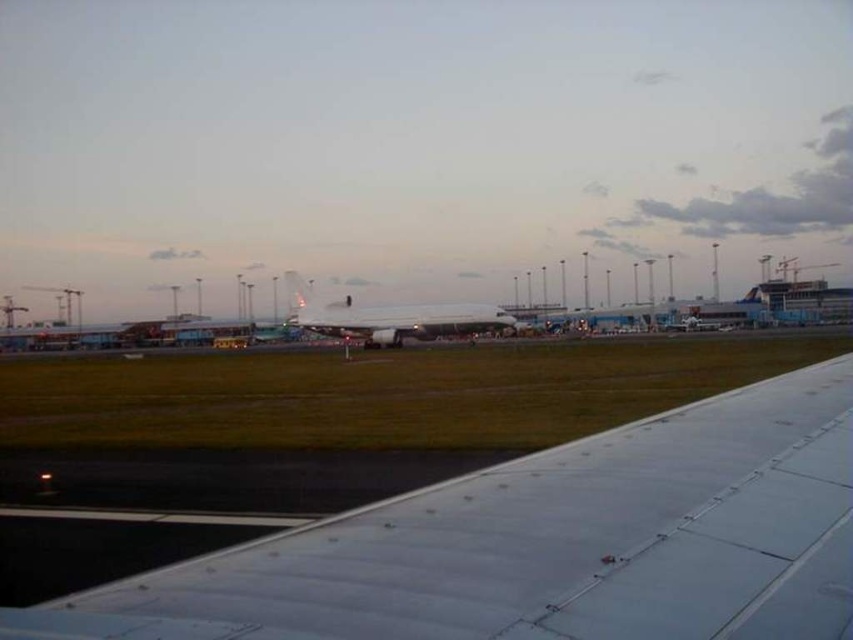
Who is shorter, white metallic wing at lower right or white glossy airplane at center?

white metallic wing at lower right is shorter.

Does point (590, 586) lie behind point (457, 333)?

No, it is in front of (457, 333).

This screenshot has height=640, width=853. Identify the location of white metallic wing at lower right. (547, 544).